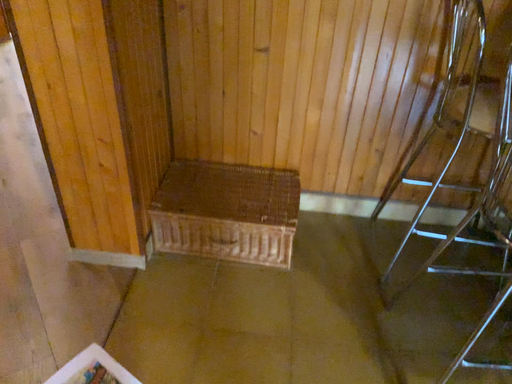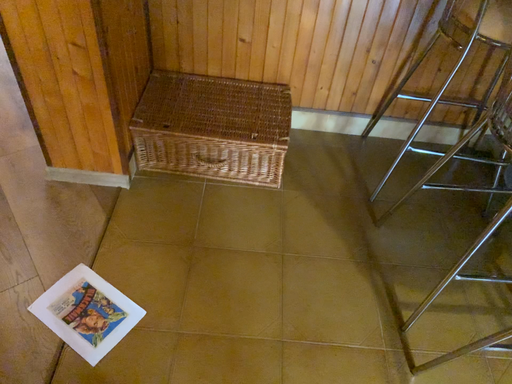
Question: How did the camera likely rotate when shooting the video?

Choices:
 (A) rotated downward
 (B) rotated upward

Answer: (A)